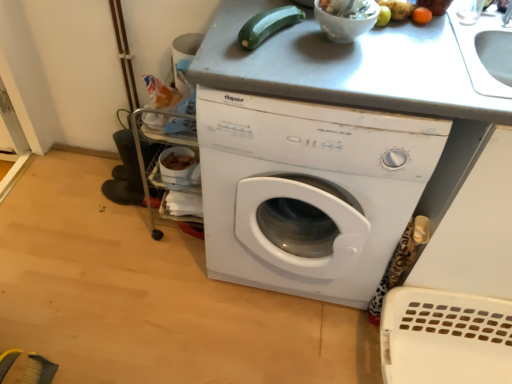
This screenshot has height=384, width=512. In order to click on vacant point to the left of green matte zucchini at upper center, the 2th vegetable from the right in this screenshot , I will do `click(227, 34)`.